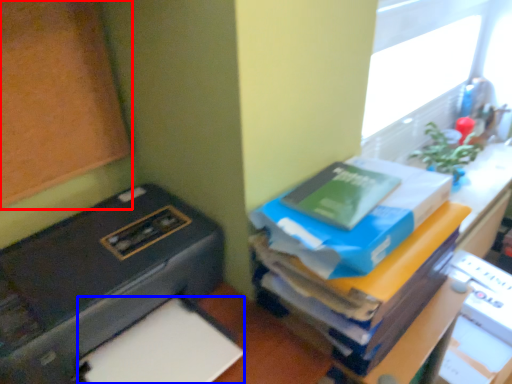
Question: Among these objects, which one is farthest to the camera, bulletin board (highlighted by a red box) or paper (highlighted by a blue box)?

Choices:
 (A) bulletin board
 (B) paper

Answer: (B)